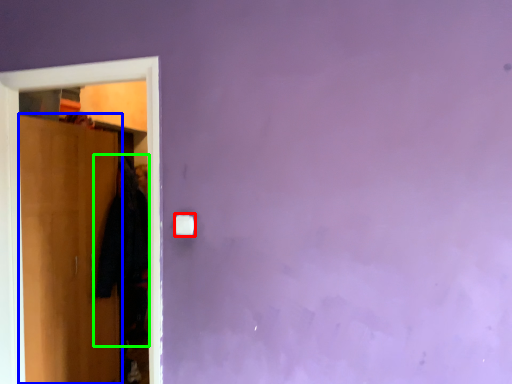
Question: Based on their relative distances, which object is farther from light switch (highlighted by a red box)? Choose from door (highlighted by a blue box) and clothing (highlighted by a green box).

Choices:
 (A) door
 (B) clothing

Answer: (B)